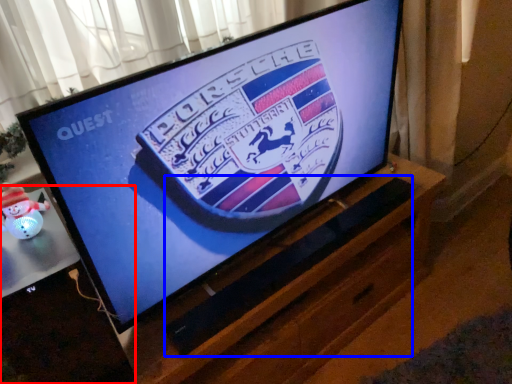
Question: Which point is further to the camera, desktop (highlighted by a red box) or speaker (highlighted by a blue box)?

Choices:
 (A) desktop
 (B) speaker

Answer: (B)